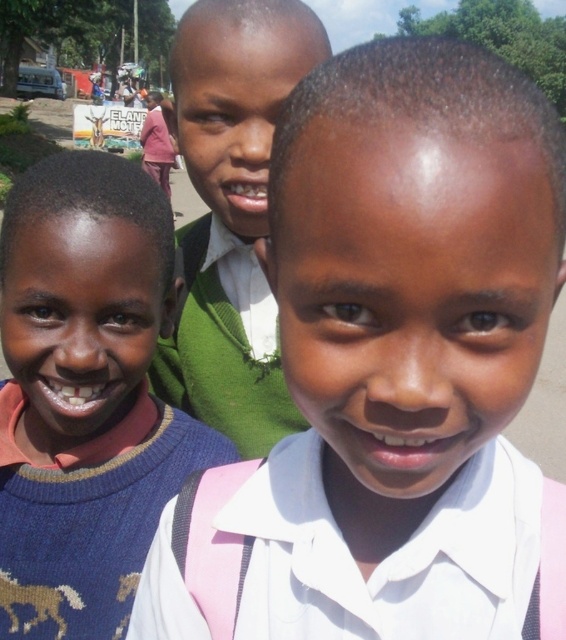
You are standing in a rural area and see a child wearing a pink fabric at center. If you want to take a photo of them without any blur, and your camera requires you to be at least 18 inches away to focus properly, can you do it?

The pink fabric at center and viewer are 16.01 inches apart, which is less than the required 18 inches for the camera to focus properly. Therefore, you cannot take a clear photo without blur.

You are a tailor trying to fit a new vest for both children wearing the blue knitted sweater at left and the green sweater at center. Which child will require a wider vest?

The green sweater at center requires a wider vest since it has a greater width than the blue knitted sweater at left.

You are a photographer trying to focus on the pink fabric at center. What coordinates should you set your camera to ensure it is in the center of the frame?

The pink fabric at center is located at coordinates point (393, 365), so you should set your camera to those coordinates to center it.